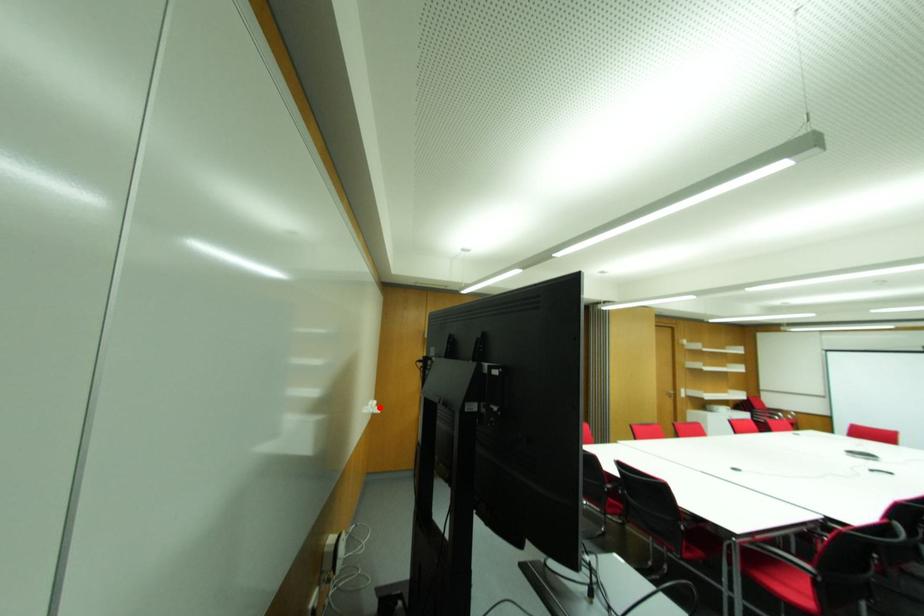
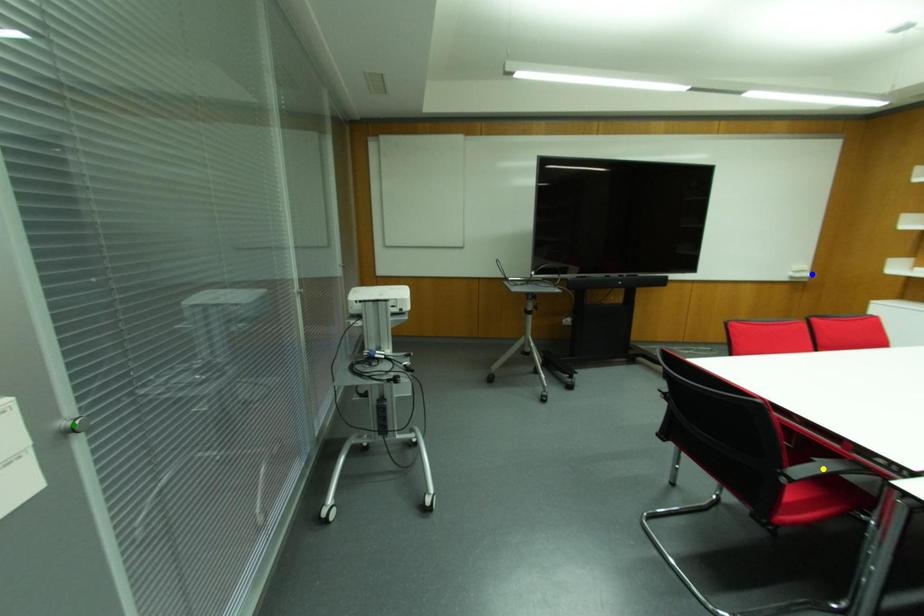
Question: I am providing you with two images of the same scene from different viewpoints. A red point is marked on the first image. You are given multiple points on the second image. Which spot in image 2 lines up with the point in image 1?

Choices:
 (A) yellow point
 (B) green point
 (C) blue point

Answer: (C)